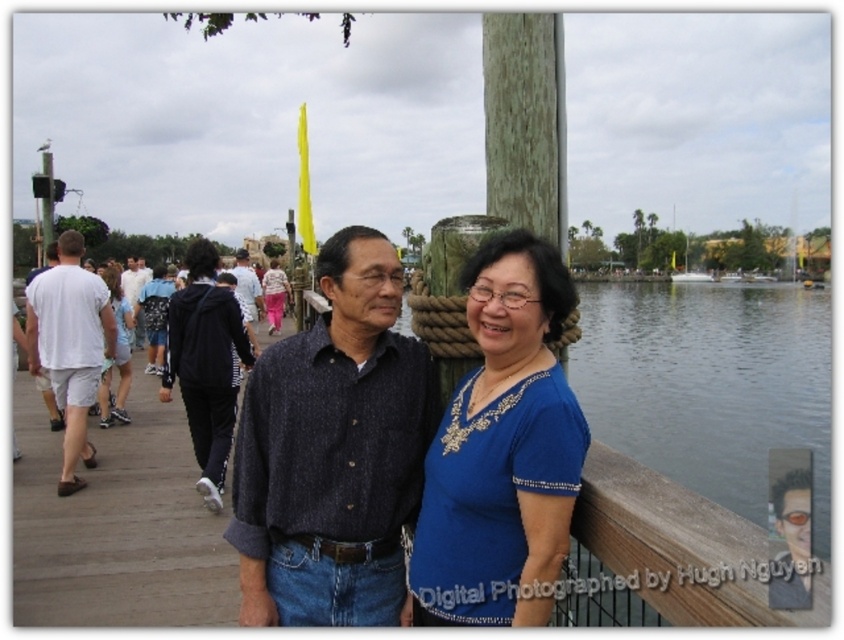
How distant is blue satin blouse at center from light blue fabric dress at left?

blue satin blouse at center is 25.88 feet away from light blue fabric dress at left.

Can you confirm if blue satin blouse at center is wider than light blue fabric dress at left?

Yes, blue satin blouse at center is wider than light blue fabric dress at left.

Is point (471, 524) positioned in front of point (120, 310)?

That is True.

Locate an element on the screen. This screenshot has width=844, height=640. blue satin blouse at center is located at coordinates (502, 449).

Can you confirm if dark blue textured shirt at center is taller than light blue jeans at center?

Incorrect, dark blue textured shirt at center's height is not larger of light blue jeans at center's.

Between point (303, 524) and point (247, 273), which one is positioned in front?

Point (303, 524) is in front.

Which is behind, point (347, 540) or point (241, 269)?

Point (241, 269)

Locate an element on the screen. Image resolution: width=844 pixels, height=640 pixels. dark blue textured shirt at center is located at coordinates (333, 451).

Is light blue fabric dress at left positioned at the back of light blue jeans at center?

No, light blue fabric dress at left is closer to the viewer.

Where is `light blue fabric dress at left`? light blue fabric dress at left is located at coordinates [116, 353].